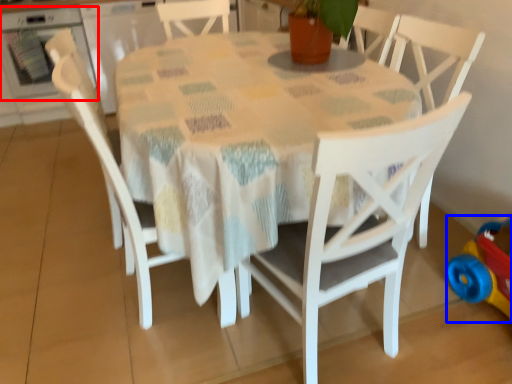
Question: Which object is further to the camera taking this photo, oven (highlighted by a red box) or toy (highlighted by a blue box)?

Choices:
 (A) oven
 (B) toy

Answer: (A)